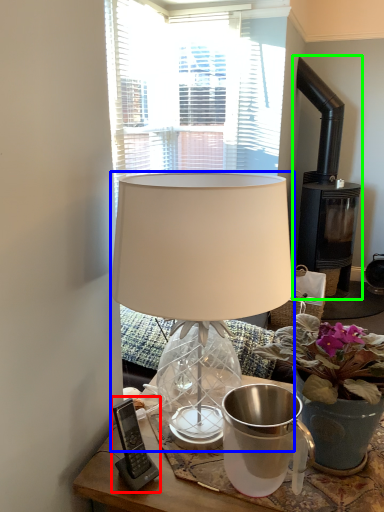
Question: Which is nearer to the gadget (highlighted by a red box)? lamp (highlighted by a blue box) or fireplace (highlighted by a green box).

Choices:
 (A) lamp
 (B) fireplace

Answer: (A)